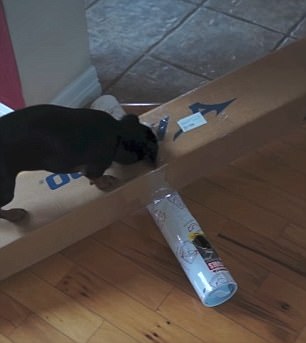
Locate an element on the screen. This screenshot has width=306, height=343. red painted wall is located at coordinates (8, 72).